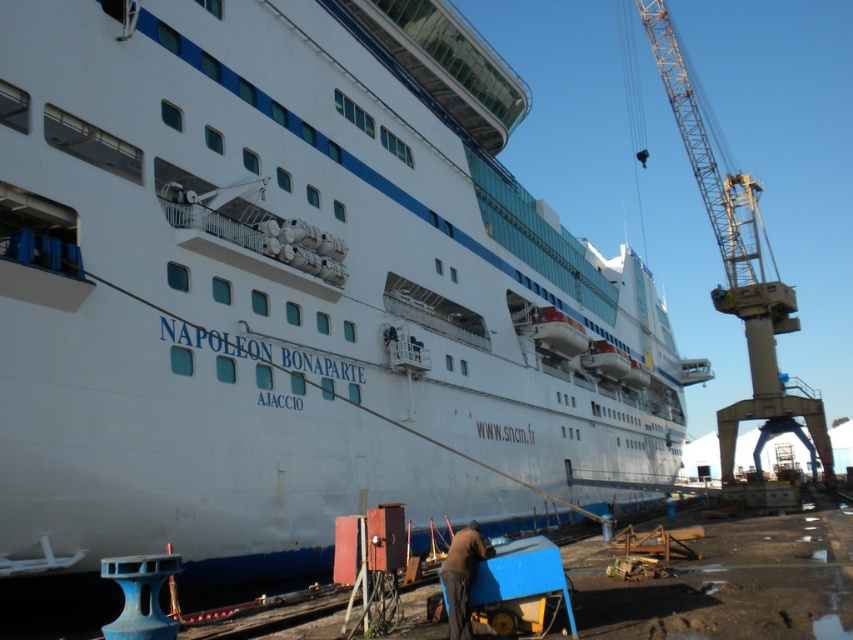
Question: Is metallic yellow crane at right smaller than brown leather jacket at lower center?

Choices:
 (A) no
 (B) yes

Answer: (A)

Question: Does metallic yellow crane at right come in front of brown leather jacket at lower center?

Choices:
 (A) no
 (B) yes

Answer: (A)

Question: Is metallic yellow crane at right to the right of brown leather jacket at lower center from the viewer's perspective?

Choices:
 (A) no
 (B) yes

Answer: (B)

Question: Which object is farther from the camera taking this photo?

Choices:
 (A) metallic yellow crane at right
 (B) brown leather jacket at lower center

Answer: (A)

Question: Which object is closer to the camera taking this photo?

Choices:
 (A) brown leather jacket at lower center
 (B) metallic yellow crane at right

Answer: (A)